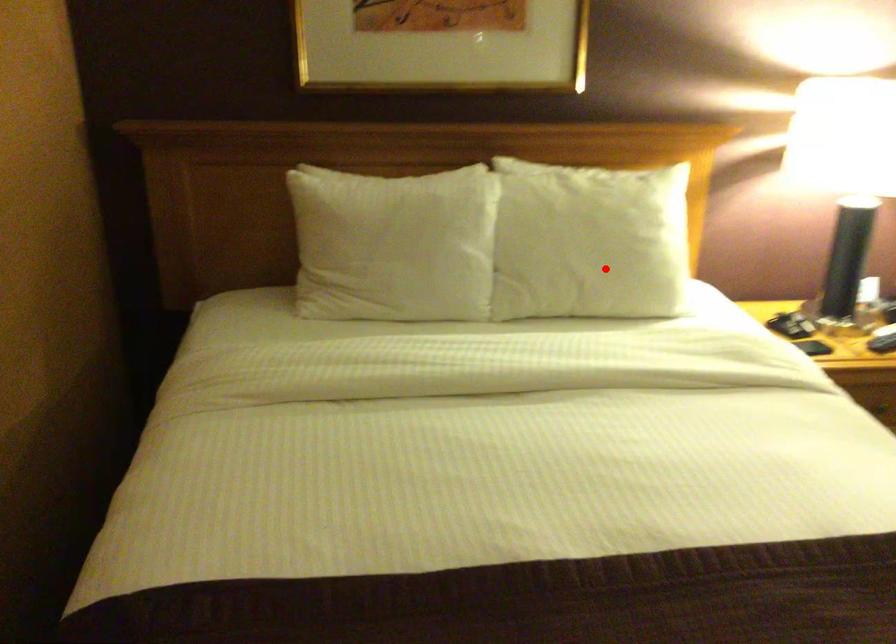
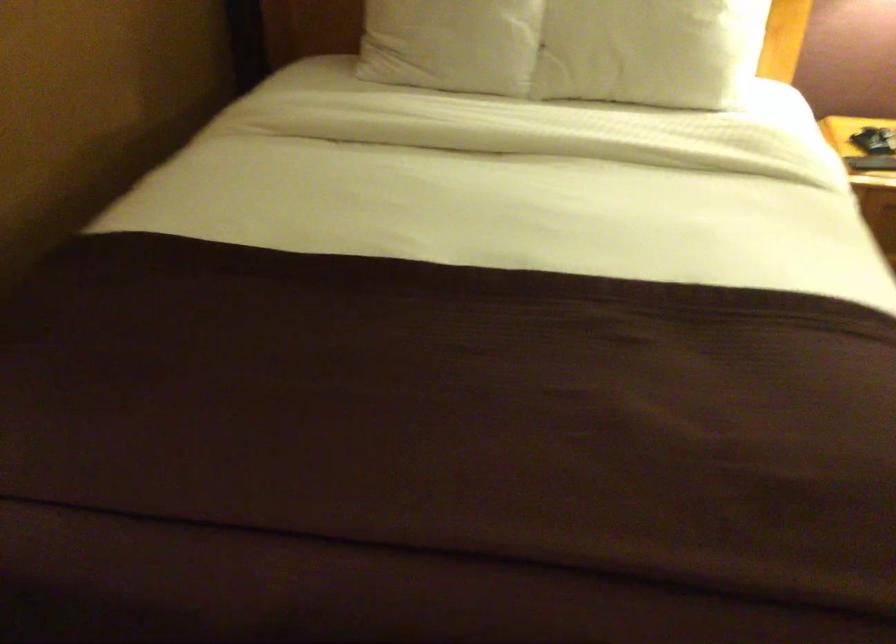
Locate, in the second image, the point that corresponds to the highlighted location in the first image.

(649, 51)